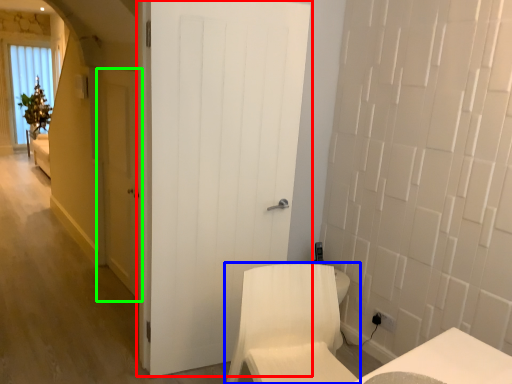
Question: Which object is the farthest from door (highlighted by a red box)? Choose among these: furniture (highlighted by a blue box) or door (highlighted by a green box).

Choices:
 (A) furniture
 (B) door

Answer: (B)